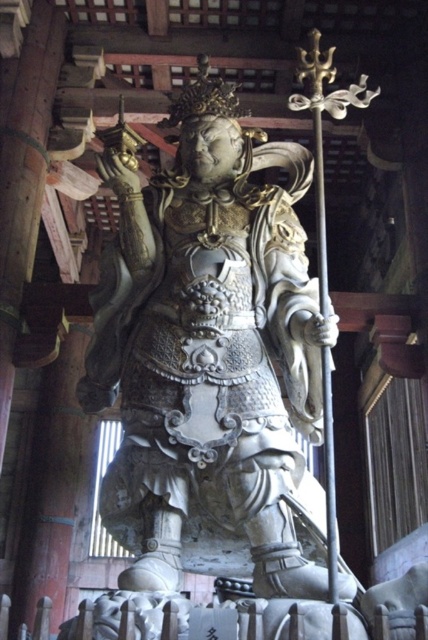
Is point (125, 248) closer to viewer compared to point (326, 356)?

No, it is behind (326, 356).

Between white stone statue at center and polished wood pole at center, which one has less height?

Standing shorter between the two is polished wood pole at center.

Who is more forward, (109, 179) or (330, 490)?

Positioned in front is point (330, 490).

Where is `white stone statue at center`? white stone statue at center is located at coordinates (208, 349).